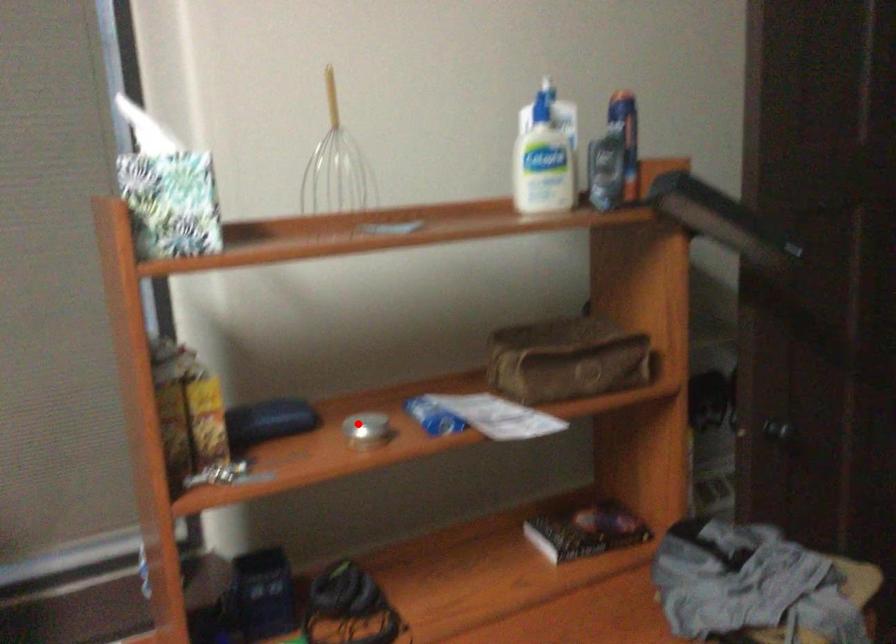
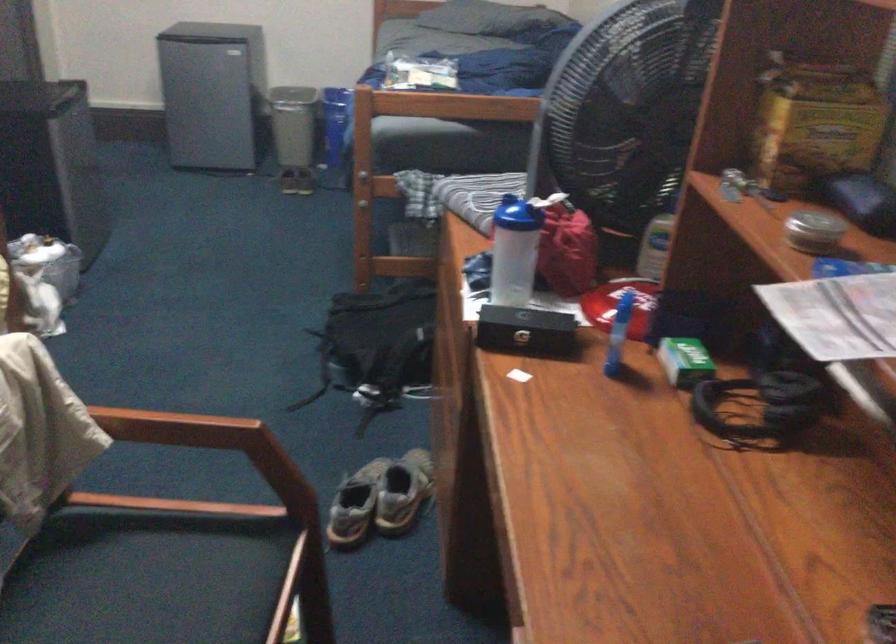
Question: A red point is marked in image1. In image2, is the corresponding 3D point closer to the camera or farther? Reply with the corresponding letter.

Choices:
 (A) The corresponding 3D point is closer.
 (B) The corresponding 3D point is farther.

Answer: (A)